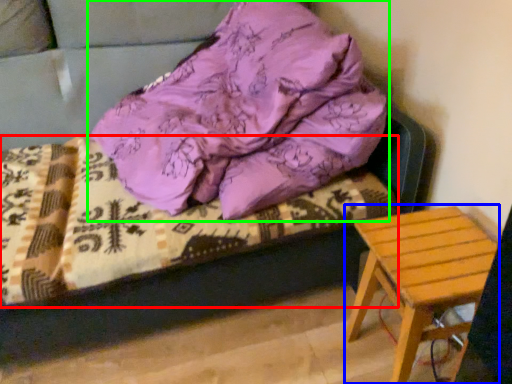
Question: Based on their relative distances, which object is farther from bedding (highlighted by a red box)? Choose from stool (highlighted by a blue box) and pillow (highlighted by a green box).

Choices:
 (A) stool
 (B) pillow

Answer: (A)